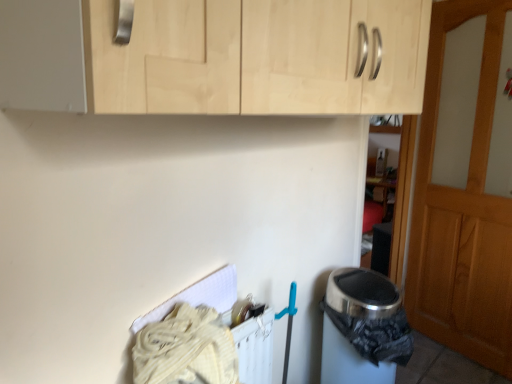
Question: Is light wood cabinet at upper center further to the viewer compared to wooden door at right?

Choices:
 (A) no
 (B) yes

Answer: (A)

Question: Is light wood cabinet at upper center taller than wooden door at right?

Choices:
 (A) yes
 (B) no

Answer: (B)

Question: Is light wood cabinet at upper center smaller than wooden door at right?

Choices:
 (A) no
 (B) yes

Answer: (A)

Question: Is the depth of light wood cabinet at upper center less than that of wooden door at right?

Choices:
 (A) yes
 (B) no

Answer: (A)

Question: Would you say light wood cabinet at upper center is outside wooden door at right?

Choices:
 (A) no
 (B) yes

Answer: (B)

Question: Is wooden door at right inside light wood cabinet at upper center?

Choices:
 (A) yes
 (B) no

Answer: (B)

Question: Considering the relative sizes of metallic trash can at lower right and wooden door at right in the image provided, is metallic trash can at lower right bigger than wooden door at right?

Choices:
 (A) yes
 (B) no

Answer: (B)

Question: From the image's perspective, is metallic trash can at lower right below wooden door at right?

Choices:
 (A) no
 (B) yes

Answer: (B)

Question: From a real-world perspective, is metallic trash can at lower right located higher than wooden door at right?

Choices:
 (A) no
 (B) yes

Answer: (A)

Question: Can you confirm if metallic trash can at lower right is thinner than wooden door at right?

Choices:
 (A) yes
 (B) no

Answer: (B)

Question: Is metallic trash can at lower right in front of wooden door at right?

Choices:
 (A) yes
 (B) no

Answer: (A)

Question: Would you say wooden door at right is part of metallic trash can at lower right's contents?

Choices:
 (A) no
 (B) yes

Answer: (A)

Question: Considering the relative sizes of light wood cabinet at upper center and metallic trash can at lower right in the image provided, is light wood cabinet at upper center smaller than metallic trash can at lower right?

Choices:
 (A) yes
 (B) no

Answer: (B)